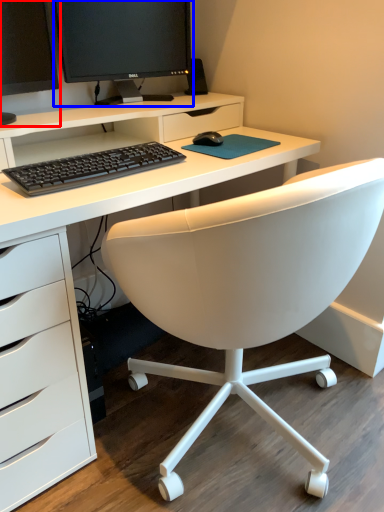
Question: Which of the following is the closest to the observer, computer monitor (highlighted by a red box) or computer monitor (highlighted by a blue box)?

Choices:
 (A) computer monitor
 (B) computer monitor

Answer: (A)